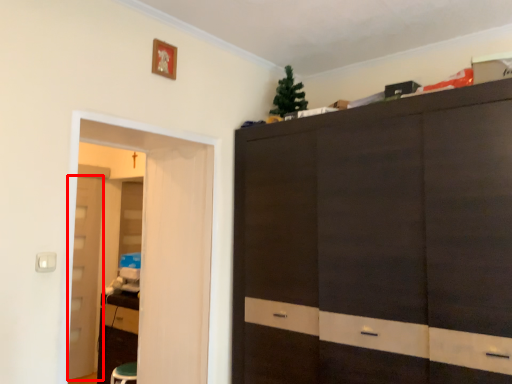
Question: From the image's perspective, considering the relative positions of door (annotated by the red box) and screen door in the image provided, where is door (annotated by the red box) located with respect to the staircase?

Choices:
 (A) below
 (B) above

Answer: (A)